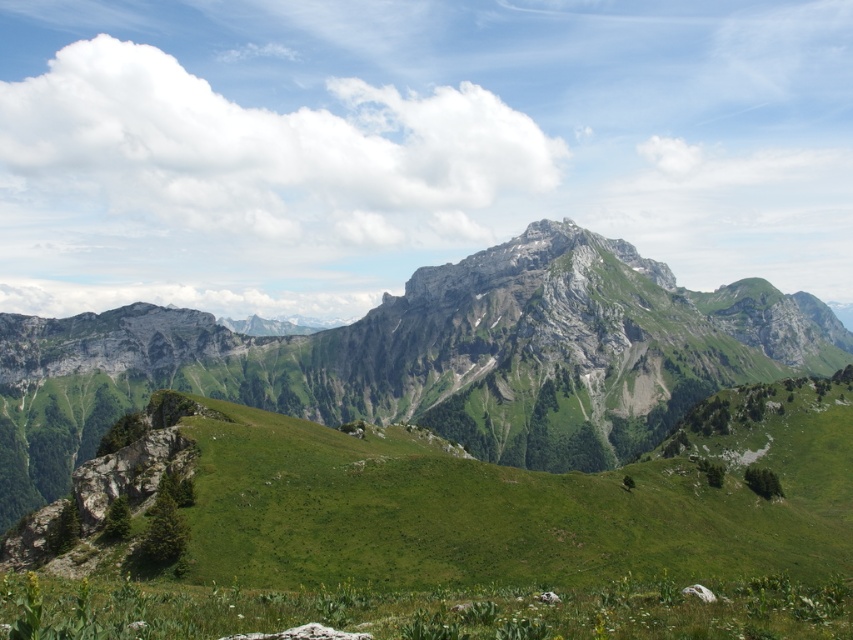
Which is below, green grassy mountain at center or green grassy at lower left?

green grassy at lower left is below.

Is point (757, 500) positioned after point (231, 588)?

That is True.

The height and width of the screenshot is (640, 853). I want to click on green grassy mountain at center, so click(479, 433).